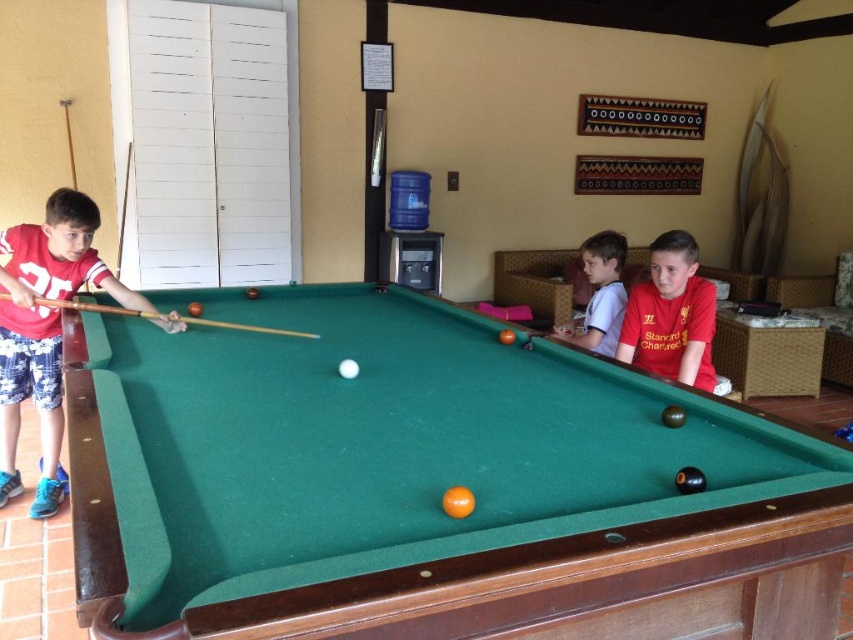
Question: Which object is the closest to the white cotton shirt at upper right?

Choices:
 (A) matte red shirt at center
 (B) matte red shirt at left
 (C) green felt pool table at center
 (D) wooden cue at left

Answer: (A)

Question: Which point appears farthest from the camera in this image?

Choices:
 (A) (33, 301)
 (B) (677, 316)

Answer: (B)

Question: Does white cotton shirt at upper right come in front of wooden cue at left?

Choices:
 (A) yes
 (B) no

Answer: (B)

Question: Is green felt pool table at center closer to the viewer compared to matte red shirt at left?

Choices:
 (A) no
 (B) yes

Answer: (B)

Question: Which point is closer to the camera taking this photo?

Choices:
 (A) (106, 289)
 (B) (606, 241)

Answer: (A)

Question: Is green felt pool table at center thinner than wooden cue at left?

Choices:
 (A) no
 (B) yes

Answer: (A)